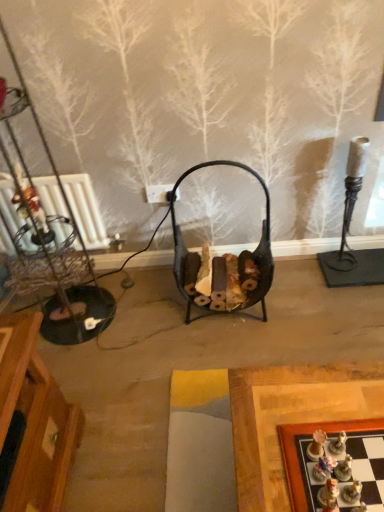
Question: Does matte plastic chess piece at lower right have a lesser width compared to wooden chessboard at lower right?

Choices:
 (A) no
 (B) yes

Answer: (B)

Question: From the image's perspective, is matte plastic chess piece at lower right on top of wooden chessboard at lower right?

Choices:
 (A) no
 (B) yes

Answer: (B)

Question: Is matte plastic chess piece at lower right bigger than wooden chessboard at lower right?

Choices:
 (A) yes
 (B) no

Answer: (B)

Question: Considering the relative sizes of matte plastic chess piece at lower right and wooden chessboard at lower right in the image provided, is matte plastic chess piece at lower right shorter than wooden chessboard at lower right?

Choices:
 (A) yes
 (B) no

Answer: (B)

Question: Does matte plastic chess piece at lower right have a greater height compared to wooden chessboard at lower right?

Choices:
 (A) no
 (B) yes

Answer: (B)

Question: Is matte plastic chess piece at lower right far away from wooden chessboard at lower right?

Choices:
 (A) no
 (B) yes

Answer: (A)

Question: Is black metal basket at center not near wooden chessboard at lower right?

Choices:
 (A) no
 (B) yes

Answer: (A)

Question: Can you confirm if black metal basket at center is wider than wooden chessboard at lower right?

Choices:
 (A) no
 (B) yes

Answer: (A)

Question: Is the position of black metal basket at center less distant than that of wooden chessboard at lower right?

Choices:
 (A) yes
 (B) no

Answer: (B)

Question: Is black metal basket at center positioned beyond the bounds of wooden chessboard at lower right?

Choices:
 (A) no
 (B) yes

Answer: (B)

Question: Is black metal basket at center beside wooden chessboard at lower right?

Choices:
 (A) yes
 (B) no

Answer: (B)

Question: Does black metal basket at center appear on the left side of wooden chessboard at lower right?

Choices:
 (A) no
 (B) yes

Answer: (B)

Question: From a real-world perspective, does wooden chessboard at lower right sit lower than black metal basket at center?

Choices:
 (A) yes
 (B) no

Answer: (B)